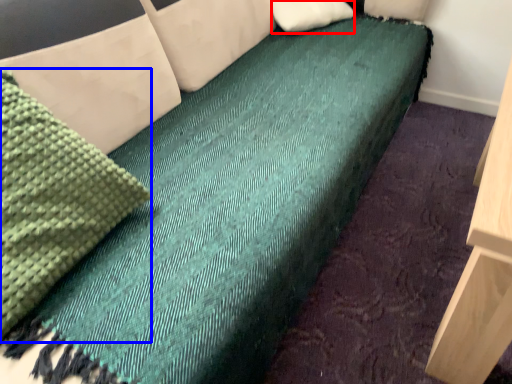
Question: Which object appears closest to the camera in this image, pillow (highlighted by a red box) or material (highlighted by a blue box)?

Choices:
 (A) pillow
 (B) material

Answer: (B)